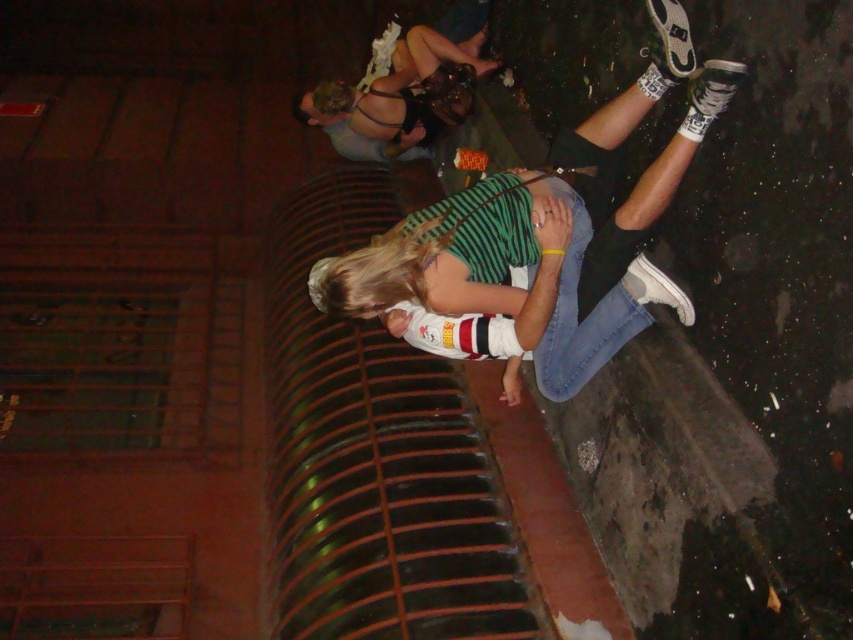
Question: Which object appears farthest from the camera in this image?

Choices:
 (A) black leather dress at upper center
 (B) white matte sneakers at center

Answer: (A)

Question: Can you confirm if white matte sneakers at center is bigger than black leather dress at upper center?

Choices:
 (A) yes
 (B) no

Answer: (A)

Question: Which point is farther to the camera?

Choices:
 (A) (376, 86)
 (B) (625, 312)

Answer: (A)

Question: Can you confirm if white matte sneakers at center is positioned to the right of black leather dress at upper center?

Choices:
 (A) yes
 (B) no

Answer: (A)

Question: Observing the image, what is the correct spatial positioning of white matte sneakers at center in reference to black leather dress at upper center?

Choices:
 (A) left
 (B) right

Answer: (B)